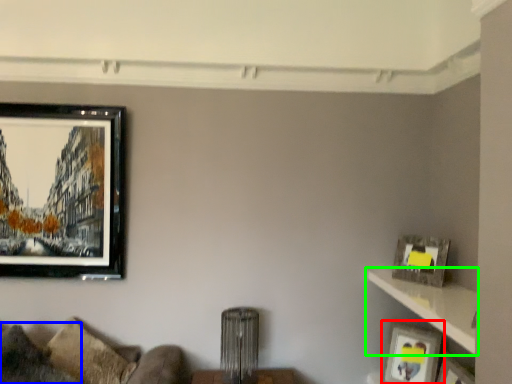
Question: Which object is the farthest from picture frame (highlighted by a red box)? Choose among these: pillow (highlighted by a blue box) or shelf (highlighted by a green box).

Choices:
 (A) pillow
 (B) shelf

Answer: (A)